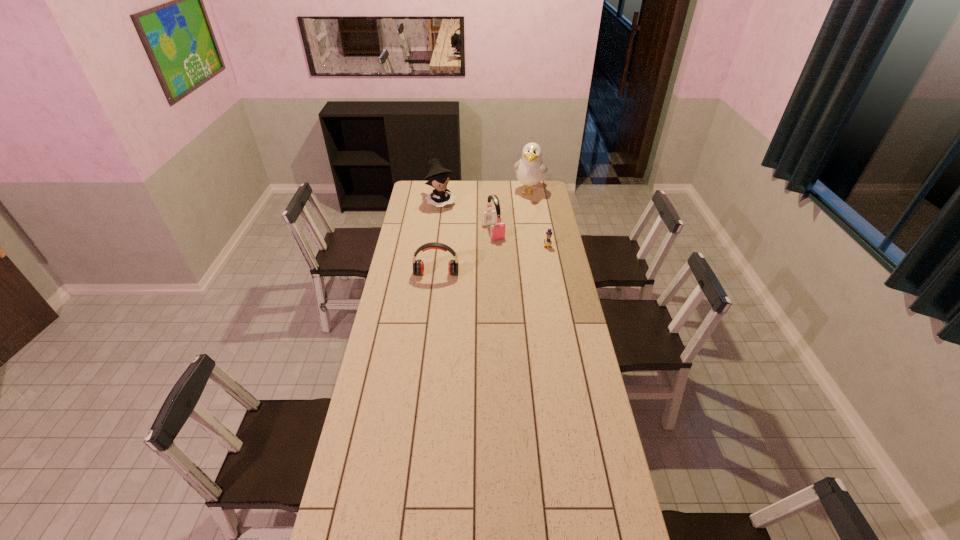
Where is `blank region between the fourth shortest object and the tallest object`? blank region between the fourth shortest object and the tallest object is located at coordinates (485, 197).

Choose which object is the third nearest neighbor to the shorter earphone. Please provide its 2D coordinates. Your answer should be formatted as a tuple, i.e. [(x, y)], where the tuple contains the x and y coordinates of a point satisfying the conditions above.

[(438, 177)]

Locate which object is the fourth closest to the second tallest object. Please provide its 2D coordinates. Your answer should be formatted as a tuple, i.e. [(x, y)], where the tuple contains the x and y coordinates of a point satisfying the conditions above.

[(548, 242)]